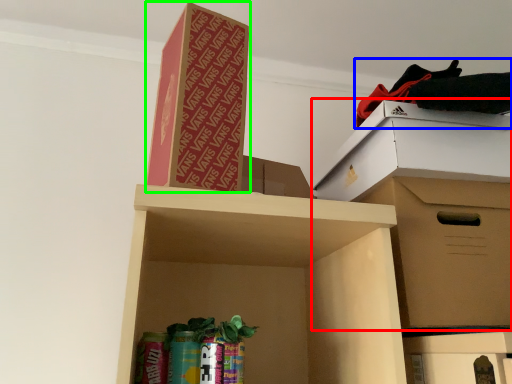
Question: Considering the real-world distances, which object is farthest from cardboard box (highlighted by a red box)? clothing (highlighted by a blue box) or cardboard box (highlighted by a green box)?

Choices:
 (A) clothing
 (B) cardboard box

Answer: (B)